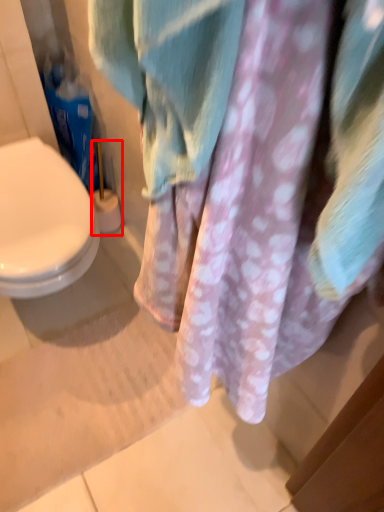
Question: From the image's perspective, where is brush (annotated by the red box) located in relation to laundry in the image?

Choices:
 (A) above
 (B) below

Answer: (A)